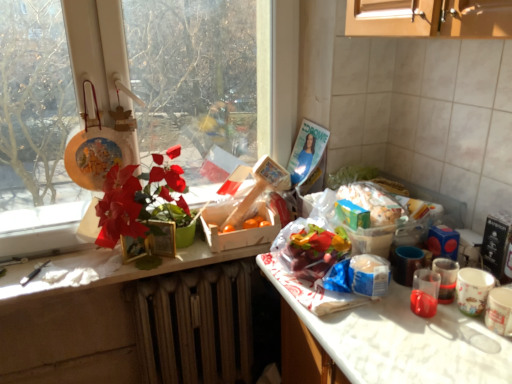
Question: From a real-world perspective, does transparent plastic cup at lower right, the second coffee cup in the right-to-left sequence, sit lower than smooth wooden counter at center?

Choices:
 (A) yes
 (B) no

Answer: (B)

Question: Can you see transparent plastic cup at lower right, the 1th coffee cup from the left, touching smooth wooden counter at center?

Choices:
 (A) no
 (B) yes

Answer: (A)

Question: Does transparent plastic cup at lower right, the 1th coffee cup from the left, have a lesser width compared to smooth wooden counter at center?

Choices:
 (A) yes
 (B) no

Answer: (A)

Question: Could smooth wooden counter at center be considered to be inside transparent plastic cup at lower right, the 1th coffee cup from the left?

Choices:
 (A) no
 (B) yes

Answer: (A)

Question: Does transparent plastic cup at lower right, the 1th coffee cup from the left, have a greater width compared to smooth wooden counter at center?

Choices:
 (A) no
 (B) yes

Answer: (A)

Question: From the image's perspective, is translucent plastic cup at right, acting as the 1th coffee cup starting from the right, positioned above or below matte plastic flower at left?

Choices:
 (A) above
 (B) below

Answer: (B)

Question: Is point coord(452,276) closer or farther from the camera than point coord(114,231)?

Choices:
 (A) farther
 (B) closer

Answer: (B)

Question: From their relative heights in the image, would you say translucent plastic cup at right, the 2th coffee cup when ordered from left to right, is taller or shorter than matte plastic flower at left?

Choices:
 (A) tall
 (B) short

Answer: (B)

Question: In terms of width, does translucent plastic cup at right, acting as the 1th coffee cup starting from the right, look wider or thinner when compared to matte plastic flower at left?

Choices:
 (A) thin
 (B) wide

Answer: (A)

Question: From a real-world perspective, is matte plastic flower at left positioned above or below smooth wooden counter at center?

Choices:
 (A) below
 (B) above

Answer: (B)

Question: Considering the positions of matte plastic flower at left and smooth wooden counter at center in the image, is matte plastic flower at left wider or thinner than smooth wooden counter at center?

Choices:
 (A) wide
 (B) thin

Answer: (A)

Question: Do you think matte plastic flower at left is within smooth wooden counter at center, or outside of it?

Choices:
 (A) outside
 (B) inside

Answer: (A)

Question: Is matte plastic flower at left taller or shorter than smooth wooden counter at center?

Choices:
 (A) short
 (B) tall

Answer: (B)

Question: Based on their positions, is brown textured radiator at lower center located to the left or right of translucent plastic container at center?

Choices:
 (A) right
 (B) left

Answer: (B)

Question: Is brown textured radiator at lower center spatially inside translucent plastic container at center, or outside of it?

Choices:
 (A) outside
 (B) inside

Answer: (A)